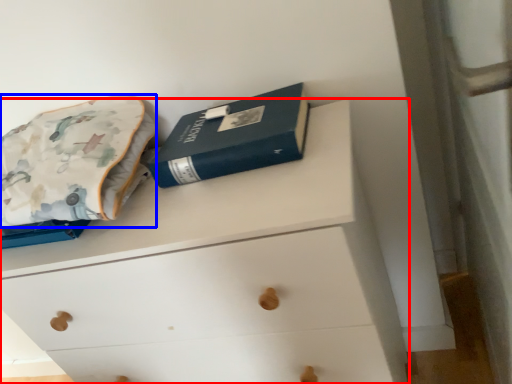
Question: Which of the following is the farthest to the observer, chest of drawers (highlighted by a red box) or throw pillow (highlighted by a blue box)?

Choices:
 (A) chest of drawers
 (B) throw pillow

Answer: (B)